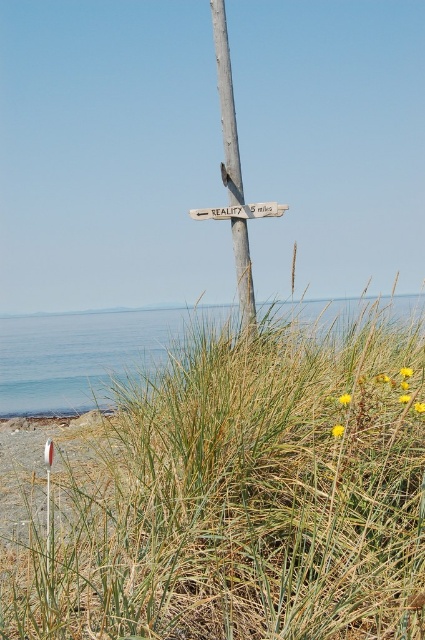
Which of these two, wooden signpost at center or white plastic sign at center, stands taller?

wooden signpost at center

Does wooden signpost at center have a lesser width compared to white plastic sign at center?

Yes, wooden signpost at center is thinner than white plastic sign at center.

Find the location of a particular element. The width and height of the screenshot is (425, 640). wooden signpost at center is located at coordinates (226, 104).

Is green grassy at center behind white plastic sign at center?

No, it is in front of white plastic sign at center.

Can you confirm if green grassy at center is wider than white plastic sign at center?

Correct, the width of green grassy at center exceeds that of white plastic sign at center.

Describe the element at coordinates (241, 499) in the screenshot. The width and height of the screenshot is (425, 640). I see `green grassy at center` at that location.

Find the location of a particular element. The width and height of the screenshot is (425, 640). green grassy at center is located at coordinates (241, 499).

Is point (422, 349) closer to camera compared to point (223, 33)?

Yes, point (422, 349) is closer to viewer.

I want to click on green grassy at center, so click(x=241, y=499).